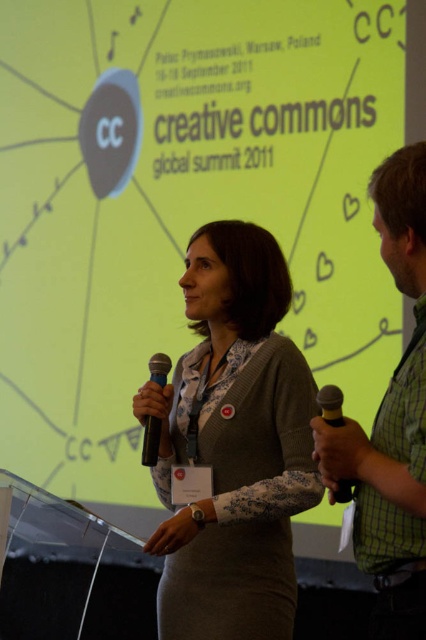
Can you confirm if green checkered shirt at right is wider than black matte microphone at center?

Yes, green checkered shirt at right is wider than black matte microphone at center.

Is point (394, 376) in front of point (155, 380)?

That is True.

Where is `green checkered shirt at right`? green checkered shirt at right is located at coordinates (391, 420).

Locate an element on the screen. green checkered shirt at right is located at coordinates (391, 420).

Can you confirm if matte gray dress at center is taller than metallic gold microphone at lower right?

Correct, matte gray dress at center is much taller as metallic gold microphone at lower right.

Is matte gray dress at center positioned at the back of metallic gold microphone at lower right?

Yes, it is.

Is point (186, 513) behind point (333, 388)?

Yes, it is behind point (333, 388).

Locate an element on the screen. The image size is (426, 640). matte gray dress at center is located at coordinates (233, 444).

Does black matte microphone at center have a greater width compared to metallic gold microphone at lower right?

In fact, black matte microphone at center might be narrower than metallic gold microphone at lower right.

Is point (158, 362) less distant than point (336, 488)?

That is False.

Where is `black matte microphone at center`? black matte microphone at center is located at coordinates click(150, 440).